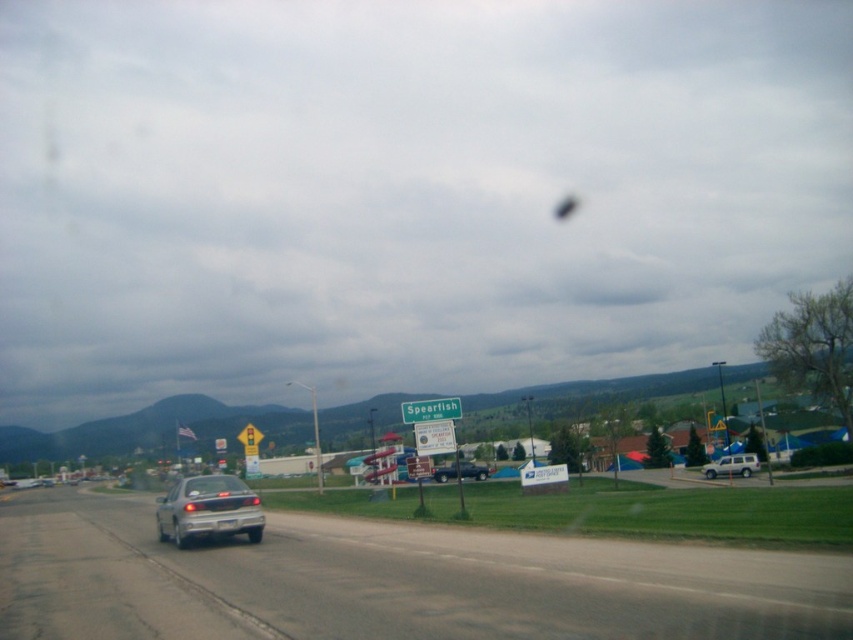
Question: Which is nearer to the silver metallic car at lower left?

Choices:
 (A) white matte suv at right
 (B) metallic blue truck at center

Answer: (B)

Question: Which object is positioned closest to the metallic blue truck at center?

Choices:
 (A) satin silver sedan at lower left
 (B) silver metallic car at lower left
 (C) white matte suv at right

Answer: (A)

Question: Does silver metallic car at lower left appear over satin silver sedan at lower left?

Choices:
 (A) no
 (B) yes

Answer: (A)

Question: Does silver metallic car at lower left appear over metallic blue truck at center?

Choices:
 (A) yes
 (B) no

Answer: (A)

Question: Which object is the farthest from the silver metallic car at lower left?

Choices:
 (A) satin silver sedan at lower left
 (B) white matte suv at right
 (C) metallic blue truck at center

Answer: (B)

Question: Is silver metallic car at lower left above satin silver sedan at lower left?

Choices:
 (A) yes
 (B) no

Answer: (B)